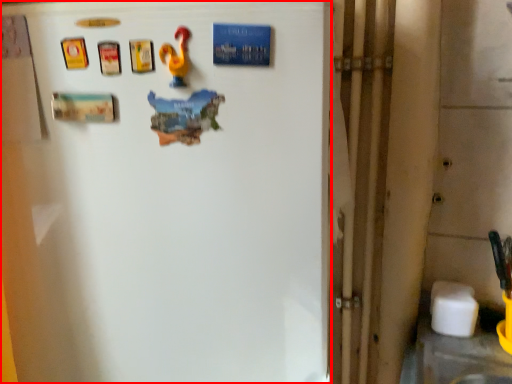
Question: In this image, where is refrigerator (annotated by the red box) located relative to toy?

Choices:
 (A) left
 (B) right

Answer: (A)